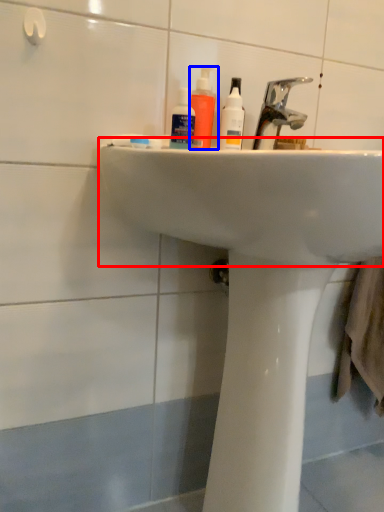
Question: Which of the following is the farthest to the observer, sink (highlighted by a red box) or mouthwash (highlighted by a blue box)?

Choices:
 (A) sink
 (B) mouthwash

Answer: (B)